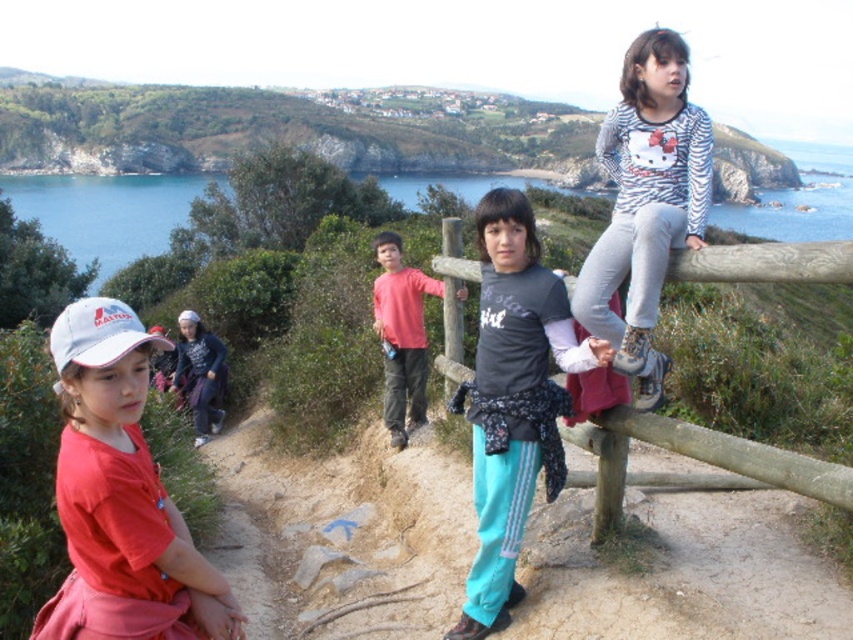
You are a photographer trying to capture a group shot of the dark gray shirt at center and the matte red shirt at center. Based on their positions, which one should you adjust to be on the left side to frame them properly?

The matte red shirt at center is already on the left side of the dark gray shirt at center, so you should adjust the dark gray shirt at center to move it further to the right to maintain proper framing.

You are a photographer standing at the camera position. You want to take a photo that includes both the point at (x=76, y=449) and the point at (x=567, y=339). Which point will appear closer to the front of the photo?

The point at (x=76, y=449) will appear closer to the front of the photo because it is closer to the camera than the point at (x=567, y=339).

From the picture: You are a photographer trying to capture the striped cotton shirt at upper right and the wooden at center in the same frame. Based on their positions, which object appears higher in the image?

The striped cotton shirt at upper right appears higher in the image than the wooden at center because it is positioned above it.